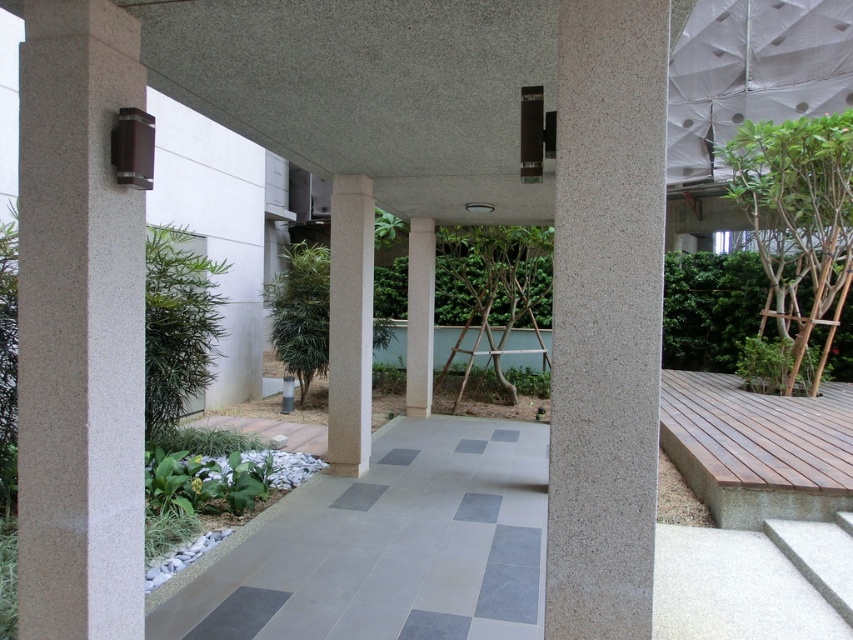
You are a landscape architect designing a garden path. You have to place two trees along the walkway. The green leafy tree at right and the green matte tree at center are your options. Which tree should you choose if you want a larger tree on the right side of the walkway?

The green leafy tree at right is bigger than the green matte tree at center, so you should choose the green leafy tree at right for the right side of the walkway to have a larger tree there.

You are a gardener planning to water the green leafy tree at right. You are currently standing on the gray tile path at center. Which direction should you move to reach the tree?

The gray tile path at center is positioned under the green leafy tree at right, so you should move forward towards the direction of the tree to reach it.